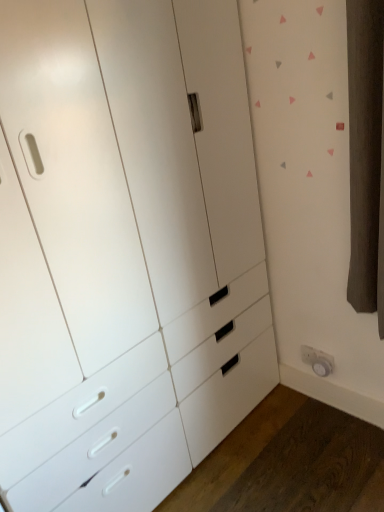
Question: Is white matte chest of drawers at center in front of or behind white plastic electric outlet at lower right in the image?

Choices:
 (A) behind
 (B) front

Answer: (B)

Question: Is point (105, 415) closer or farther from the camera than point (329, 361)?

Choices:
 (A) closer
 (B) farther

Answer: (A)

Question: Which is correct: white matte chest of drawers at center is inside white plastic electric outlet at lower right, or outside of it?

Choices:
 (A) outside
 (B) inside

Answer: (A)

Question: Would you say white plastic electric outlet at lower right is to the left or to the right of white matte chest of drawers at center in the picture?

Choices:
 (A) right
 (B) left

Answer: (A)

Question: Is white plastic electric outlet at lower right wider or thinner than white matte chest of drawers at center?

Choices:
 (A) wide
 (B) thin

Answer: (B)

Question: Is white plastic electric outlet at lower right bigger or smaller than white matte chest of drawers at center?

Choices:
 (A) small
 (B) big

Answer: (A)

Question: From their relative heights in the image, would you say white plastic electric outlet at lower right is taller or shorter than white matte chest of drawers at center?

Choices:
 (A) short
 (B) tall

Answer: (A)